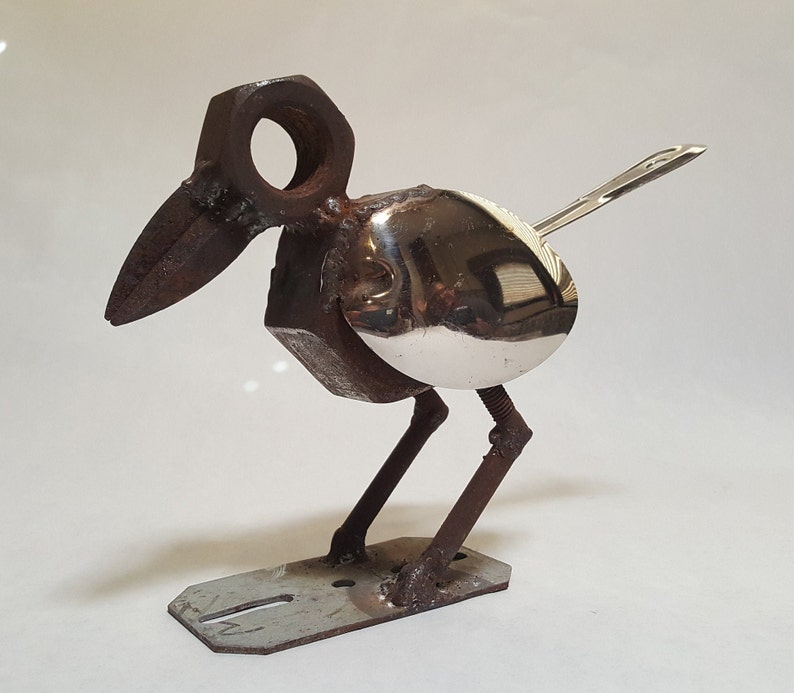
Where is `deco`? Image resolution: width=794 pixels, height=693 pixels. deco is located at coordinates (419, 267).